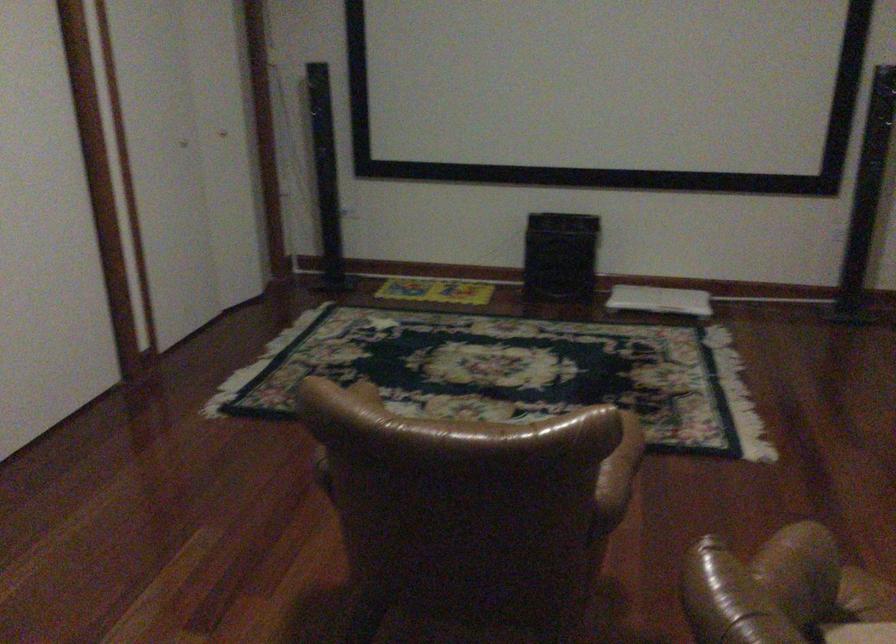
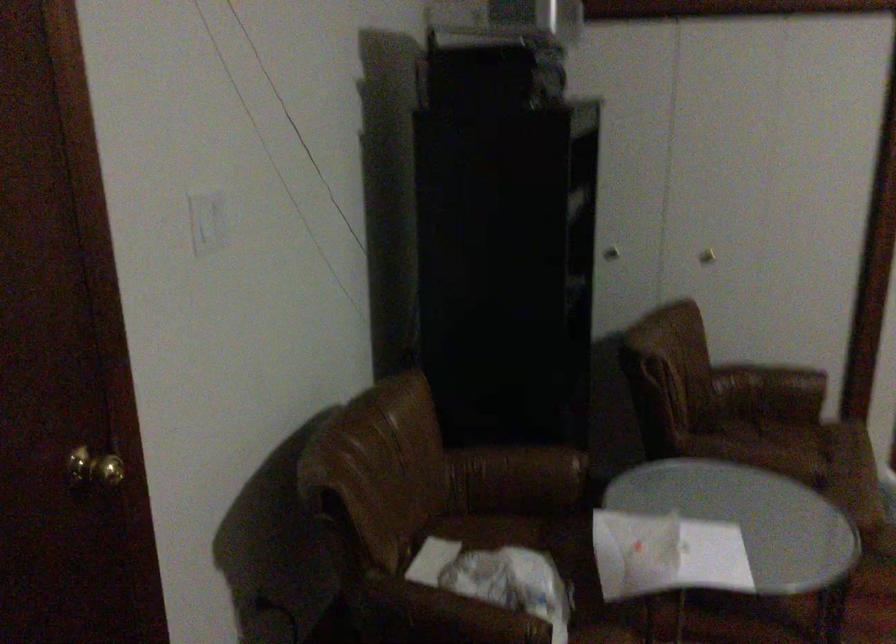
Consider the image. The first image is from the beginning of the video and the second image is from the end. How did the camera likely rotate when shooting the video?

The rotation direction of the camera is left-down.